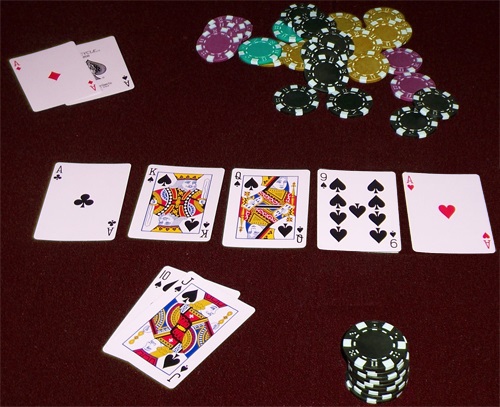
At what (x,y) coordinates should I click in order to perform the action: click on playing cards. Please return your answer as a coordinate pair (x, y). Image resolution: width=500 pixels, height=407 pixels. Looking at the image, I should click on (54, 77), (115, 67), (95, 192), (188, 198), (272, 210), (369, 210), (446, 216), (168, 297), (167, 279).